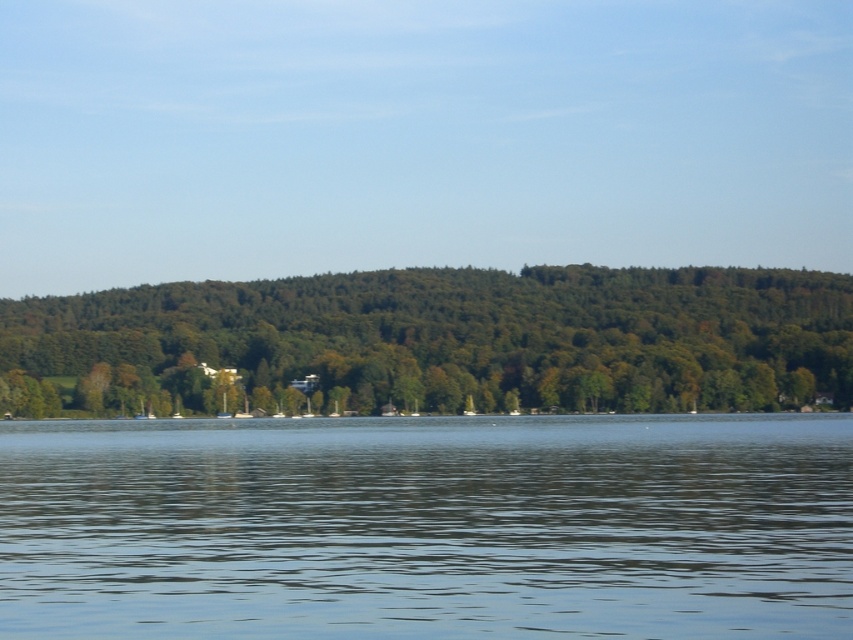
Who is shorter, transparent water at center or green leafy trees at center?

Standing shorter between the two is transparent water at center.

Who is positioned more to the left, transparent water at center or green leafy trees at center?

Positioned to the left is green leafy trees at center.

Does point (294, 484) come closer to viewer compared to point (288, 392)?

Yes, point (294, 484) is in front of point (288, 392).

The image size is (853, 640). I want to click on transparent water at center, so click(x=428, y=525).